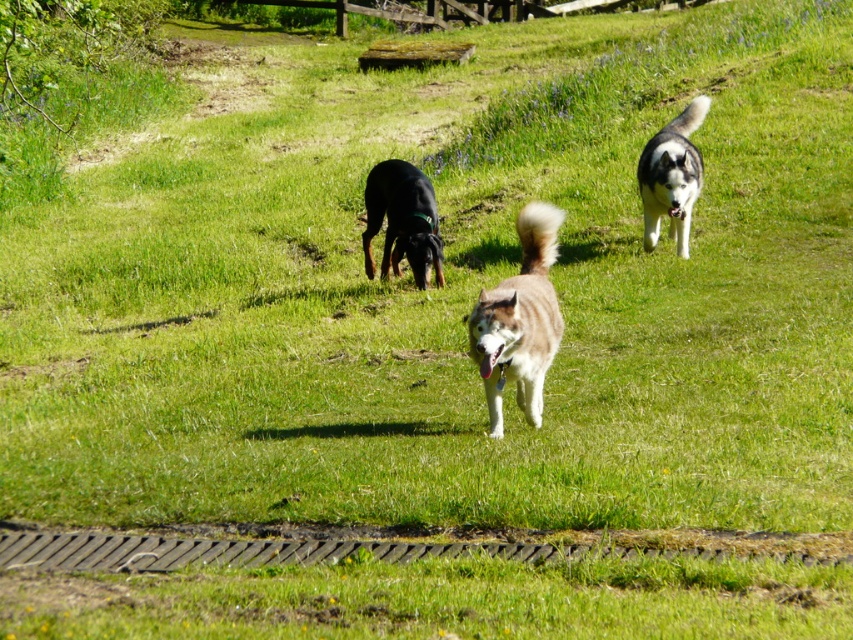
Is point (380, 188) behind point (653, 141)?

No, (380, 188) is closer to viewer.

Is black smooth dog at center taller than gray-white fur husky at upper right?

Incorrect, black smooth dog at center's height is not larger of gray-white fur husky at upper right's.

Which is in front, point (372, 205) or point (672, 186)?

Positioned in front is point (672, 186).

The width and height of the screenshot is (853, 640). What are the coordinates of `black smooth dog at center` in the screenshot? It's located at (402, 221).

Is brown fur dog at center positioned behind gray-white fur husky at upper right?

No, brown fur dog at center is closer to the viewer.

Describe the element at coordinates (519, 321) in the screenshot. I see `brown fur dog at center` at that location.

Where is `brown fur dog at center`? brown fur dog at center is located at coordinates (519, 321).

This screenshot has width=853, height=640. Describe the element at coordinates (519, 321) in the screenshot. I see `brown fur dog at center` at that location.

Is point (518, 280) more distant than point (413, 186)?

That is False.

Identify the location of brown fur dog at center. The width and height of the screenshot is (853, 640). (519, 321).